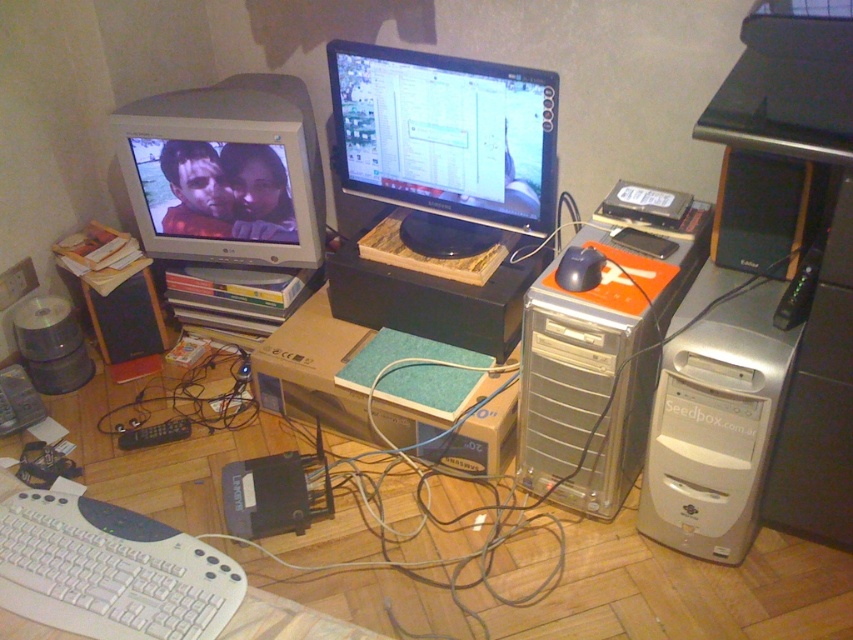
From the picture: Does matte silver monitor at left lie behind black matte mouse at center?

Yes, matte silver monitor at left is further from the viewer.

Who is more distant from viewer, (216,168) or (560,284)?

The point (216,168) is more distant.

In order to click on matte silver monitor at left in this screenshot , I will do `click(225, 172)`.

Can you confirm if matte black monitor at center is positioned to the left of black matte mouse at center?

Correct, you'll find matte black monitor at center to the left of black matte mouse at center.

Which is in front, point (456, 83) or point (602, 256)?

Point (602, 256)

Find the location of a particular element. Image resolution: width=853 pixels, height=640 pixels. matte black monitor at center is located at coordinates (445, 134).

Is transparent plastic computer tower at center-right wider than white plastic keyboard at lower left?

Yes.

Is point (631, 433) positioned behind point (141, 580)?

Yes, point (631, 433) is behind point (141, 580).

You are a GUI agent. You are given a task and a screenshot of the screen. Output one action in this format:
    pyautogui.click(x=<x>, y=<y>)
    Task: Click on the transparent plastic computer tower at center-right
    
    Given the screenshot: What is the action you would take?
    pyautogui.click(x=601, y=358)